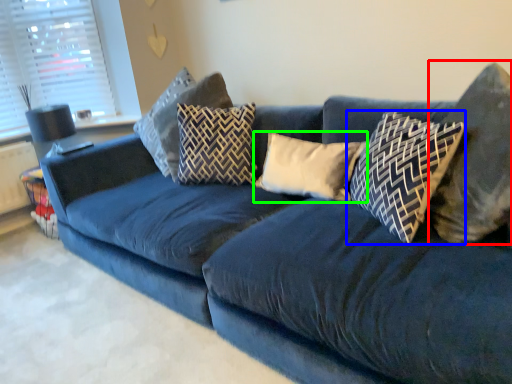
Question: Based on their relative distances, which object is nearer to pillow (highlighted by a red box)? Choose from pillow (highlighted by a blue box) and pillow (highlighted by a green box).

Choices:
 (A) pillow
 (B) pillow

Answer: (A)